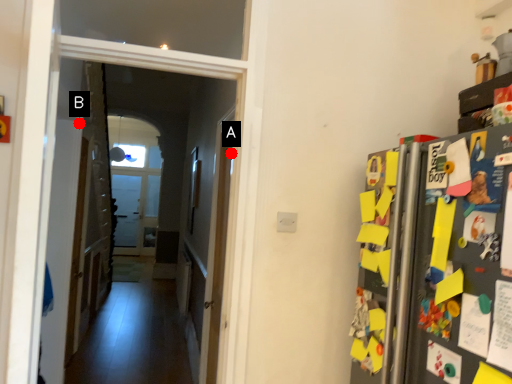
Question: Two points are circled on the image, labeled by A and B beside each circle. Which point is further to the camera?

Choices:
 (A) A is further
 (B) B is further

Answer: (B)